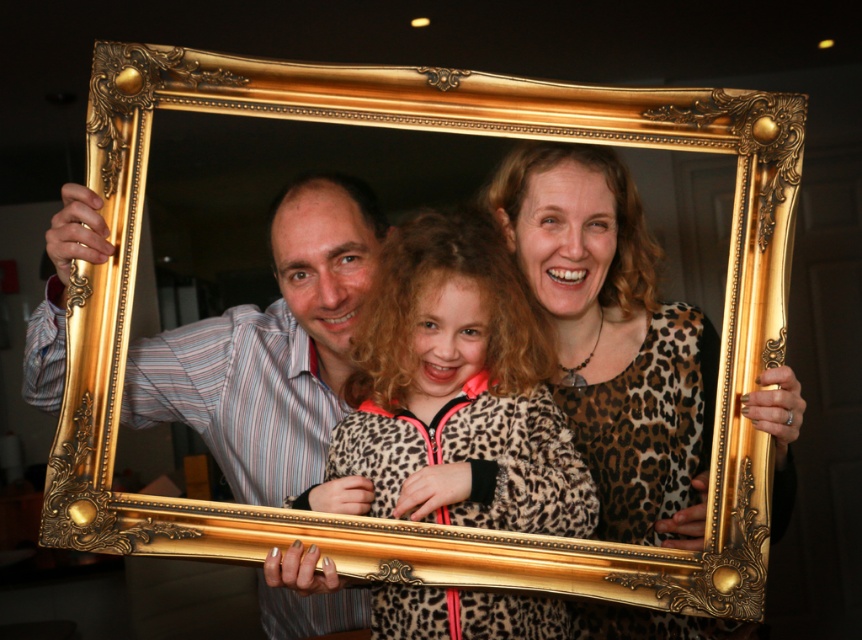
You are an artist trying to replicate this scene. You need to ensure the leopard print shirt at center and the striped shirt at left are proportionally accurate. Which shirt should you make narrower in your drawing?

The leopard print shirt at center should be made narrower since its width is less than the striped shirt at left.